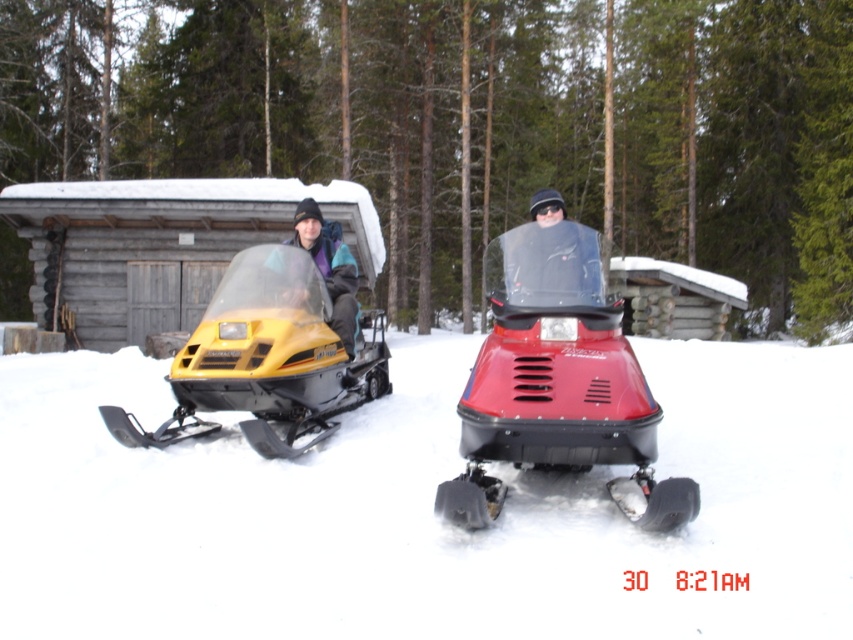
You are a photographer trying to capture both the shiny red plastic snowmobile at center and the yellow matte snowmobile at left in a single frame. Considering their heights, which one should you position closer to the camera to ensure both are fully visible in the photo?

To ensure both the shiny red plastic snowmobile at center and the yellow matte snowmobile at left are fully visible, position the taller shiny red plastic snowmobile at center closer to the camera since it is much taller than the yellow matte snowmobile at left.

You are planning to take a photo of the shiny red plastic snowmobile at center and the yellow matte snowmobile at left from where you are standing. Which one will appear larger in your photo?

The shiny red plastic snowmobile at center appears larger in the photo because it is closer to the viewer than the yellow matte snowmobile at left.